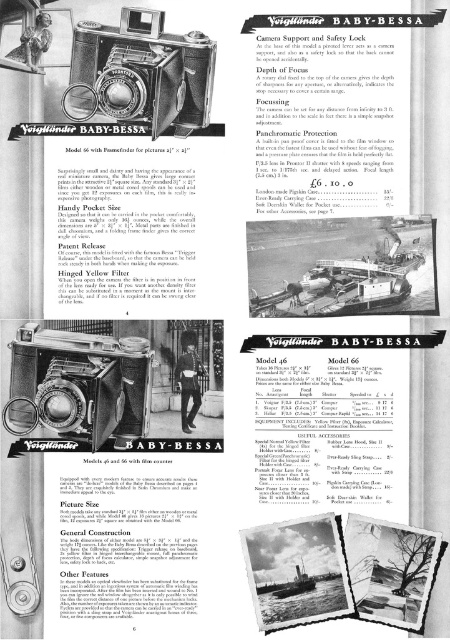
Consider the image. Is metallic silver camera at center behind matte black camera at center?

That is True.

Which is below, metallic silver camera at center or matte black camera at center?

Positioned lower is metallic silver camera at center.

This screenshot has width=450, height=640. What do you see at coordinates (79, 381) in the screenshot? I see `metallic silver camera at center` at bounding box center [79, 381].

You are a GUI agent. You are given a task and a screenshot of the screen. Output one action in this format:
    pyautogui.click(x=<x>, y=<y>)
    Task: Click on the metallic silver camera at center
    The height and width of the screenshot is (640, 450).
    Given the screenshot: What is the action you would take?
    pyautogui.click(x=79, y=381)